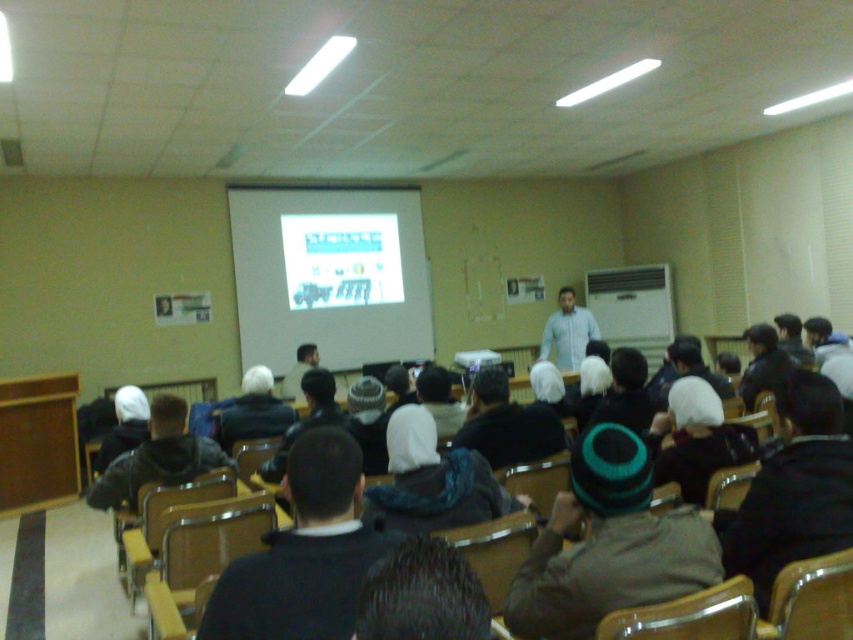
Who is positioned more to the right, dark blue knit cap at center or dark blue jacket at center?

Positioned to the right is dark blue knit cap at center.

Does dark blue knit cap at center have a lesser height compared to dark blue jacket at center?

Yes.

Who is more distant from viewer, (x=234, y=634) or (x=225, y=445)?

The point (x=225, y=445) is behind.

At what (x,y) coordinates should I click in order to perform the action: click on dark blue knit cap at center. Please return your answer as a coordinate pair (x, y). This screenshot has width=853, height=640. Looking at the image, I should click on (303, 554).

The height and width of the screenshot is (640, 853). I want to click on dark gray knit cap at lower right, so tap(793, 488).

Is dark gray knit cap at lower right shorter than dark blue jacket at center?

No.

Which is behind, point (801, 412) or point (238, 435)?

The point (238, 435) is behind.

This screenshot has width=853, height=640. Identify the location of dark gray knit cap at lower right. (793, 488).

Can you confirm if dark blue knit cap at center is wider than matte black projector at center?

No, dark blue knit cap at center is not wider than matte black projector at center.

Does dark blue knit cap at center have a lesser width compared to matte black projector at center?

Correct, dark blue knit cap at center's width is less than matte black projector at center's.

Is point (212, 620) positioned after point (462, 358)?

No, (212, 620) is in front of (462, 358).

Locate an element on the screen. The image size is (853, 640). dark blue knit cap at center is located at coordinates (303, 554).